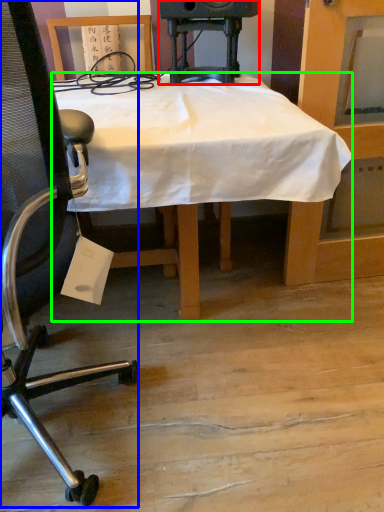
Question: Which object is the closest to the speaker (highlighted by a red box)? Choose among these: chair (highlighted by a blue box) or desk (highlighted by a green box).

Choices:
 (A) chair
 (B) desk

Answer: (B)